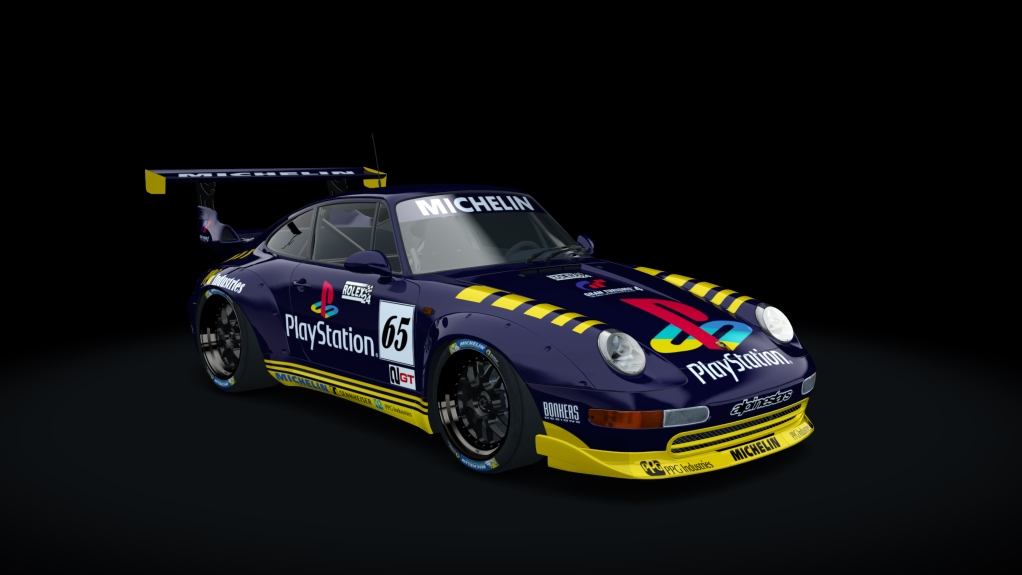
In order to click on windows in this screenshot , I will do `click(284, 233)`, `click(340, 237)`, `click(489, 231)`.